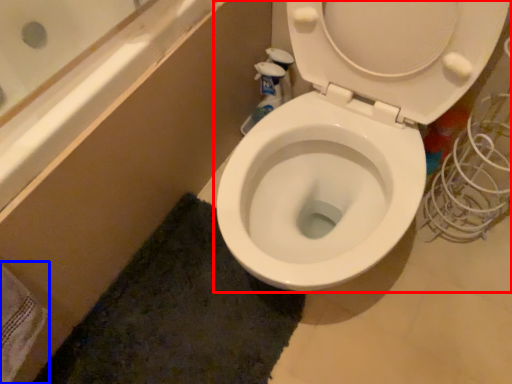
Question: Which of the following is the closest to the observer, toilet (highlighted by a red box) or bath towel (highlighted by a blue box)?

Choices:
 (A) toilet
 (B) bath towel

Answer: (A)